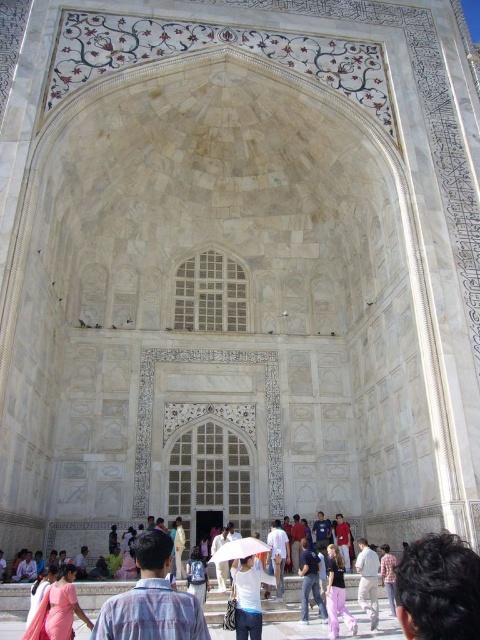
You are standing in front of the grand marble archway of the Taj Mahal and notice two shirts hanging on a rack at the center. The white cotton shirt at center and the plaid shirt at center. Which shirt is taller?

The white cotton shirt at center is taller than the plaid shirt at center.

You are standing in front of the Taj Mahal and notice a person with dark brown hair at lower right and someone wearing pink fabric pants at lower center. Which of these two items is positioned higher up in the scene?

The dark brown hair at lower right is taller than the pink fabric pants at lower center, so the dark brown hair is positioned higher up in the scene.